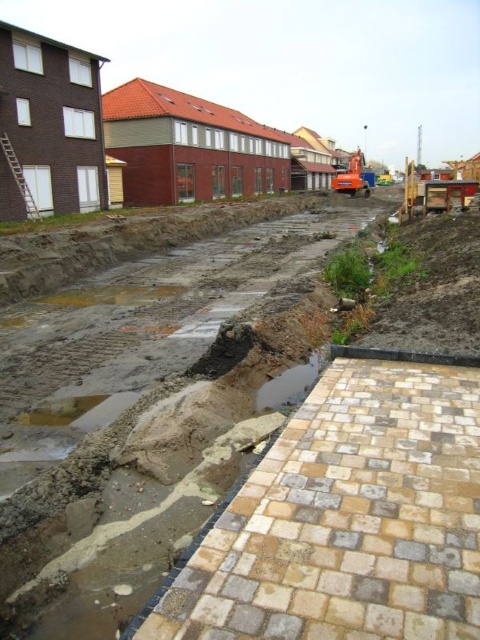
From the picture: Who is higher up, natural stone paving at lower right or shiny concrete puddle at lower center?

shiny concrete puddle at lower center is higher up.

Is point (268, 477) in front of point (308, 372)?

Yes.

Image resolution: width=480 pixels, height=640 pixels. In order to click on natural stone paving at lower right in this screenshot , I will do `click(347, 516)`.